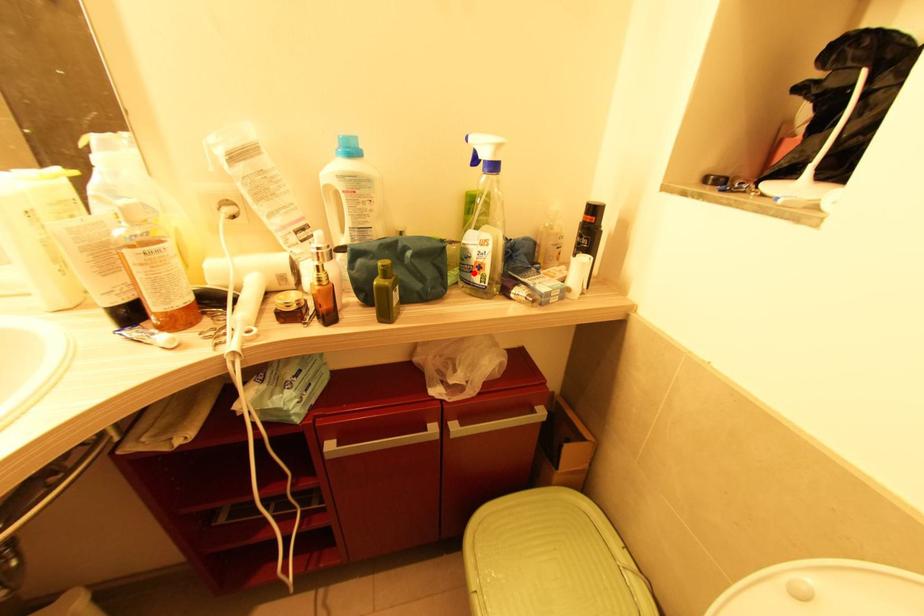
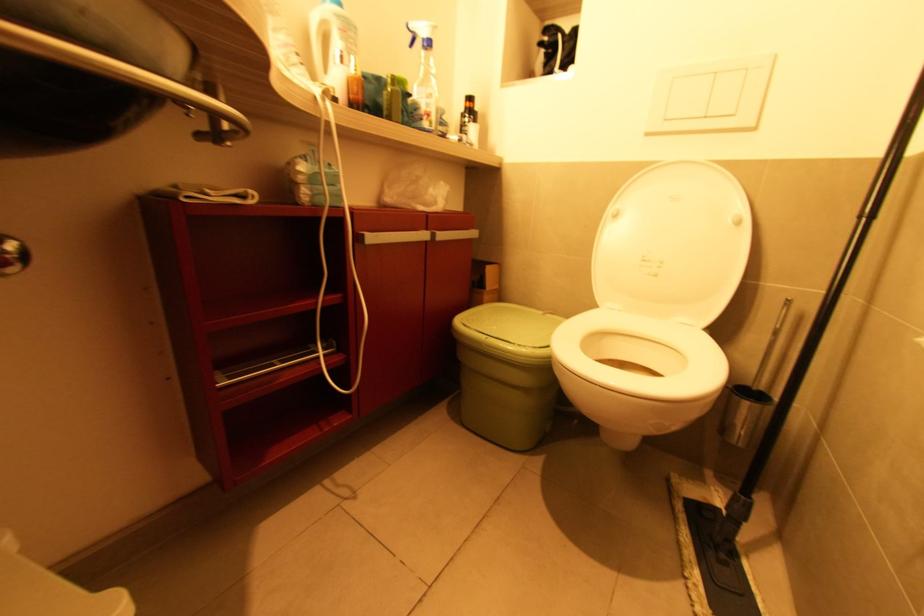
Find the pixel in the second image that matches the highlighted location in the first image.

(424, 121)